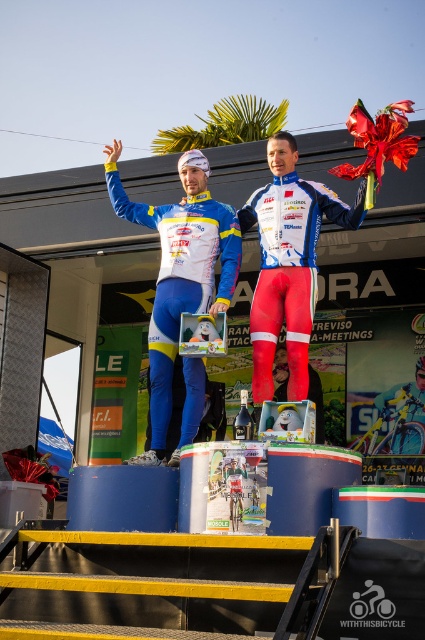
Question: Does blue/white jersey at center have a larger size compared to red matte cycling suit at center?

Choices:
 (A) no
 (B) yes

Answer: (B)

Question: Is blue/white jersey at center to the right of red matte cycling suit at center from the viewer's perspective?

Choices:
 (A) yes
 (B) no

Answer: (B)

Question: Does blue/white jersey at center appear under red matte cycling suit at center?

Choices:
 (A) yes
 (B) no

Answer: (A)